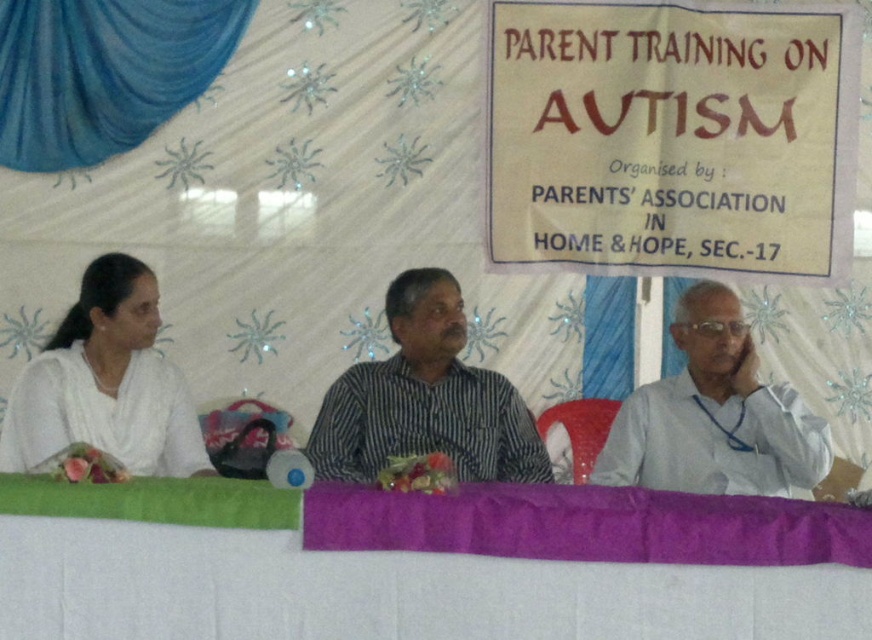
Question: Which of the following is the closest to the observer?

Choices:
 (A) (685, 509)
 (B) (659, 390)

Answer: (A)

Question: Can you confirm if white paper banner at upper center is positioned to the left of white shirt at right?

Choices:
 (A) no
 (B) yes

Answer: (A)

Question: Can you confirm if white paper banner at upper center is positioned to the left of white satin saree at left?

Choices:
 (A) yes
 (B) no

Answer: (B)

Question: Which object is positioned farthest from the purple fabric tablecloth at lower center?

Choices:
 (A) striped cotton shirt at center
 (B) white satin saree at left
 (C) white shirt at right

Answer: (B)

Question: Which point is farther from the camera taking this photo?

Choices:
 (A) (153, 362)
 (B) (779, 240)

Answer: (B)

Question: Does white paper banner at upper center appear under white satin saree at left?

Choices:
 (A) no
 (B) yes

Answer: (A)